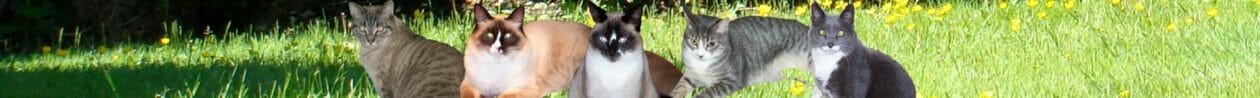
This screenshot has width=1260, height=98. I want to click on white fur, so click(499, 71).